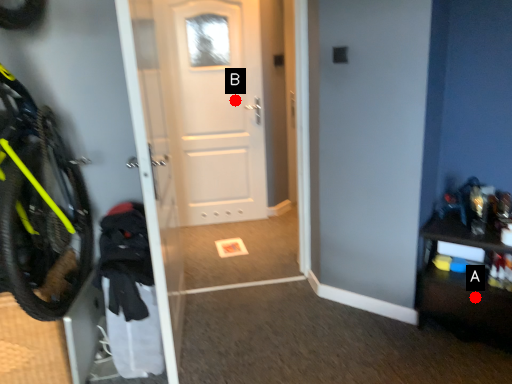
Question: Two points are circled on the image, labeled by A and B beside each circle. Which point is closer to the camera?

Choices:
 (A) A is closer
 (B) B is closer

Answer: (A)